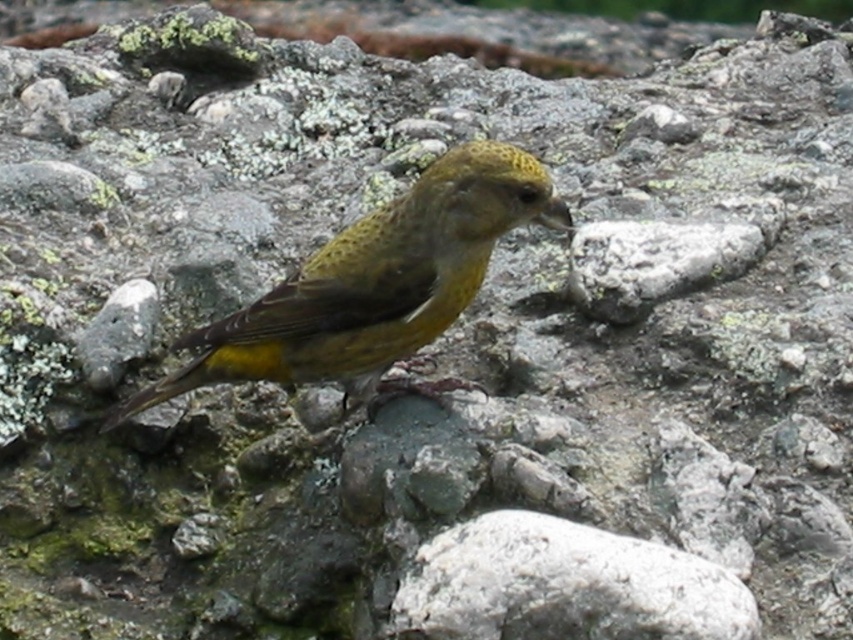
You are a photographer trying to capture the bird in the image. You notice two points marked in the scene. The first point is at coordinate point (485, 216) and the second is at point (525, 518). Which point is closer to the camera?

Point (525, 518) is closer to the camera because point (485, 216) is behind it.